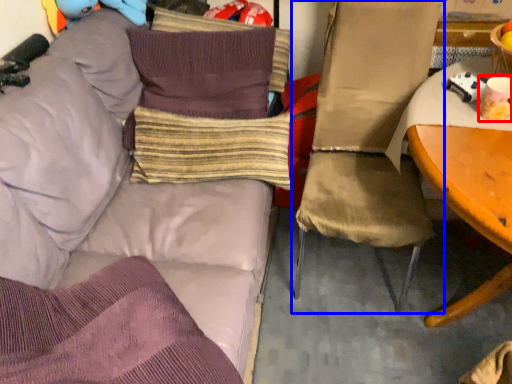
Question: Which object is further to the camera taking this photo, coffee cup (highlighted by a red box) or chair (highlighted by a blue box)?

Choices:
 (A) coffee cup
 (B) chair

Answer: (A)